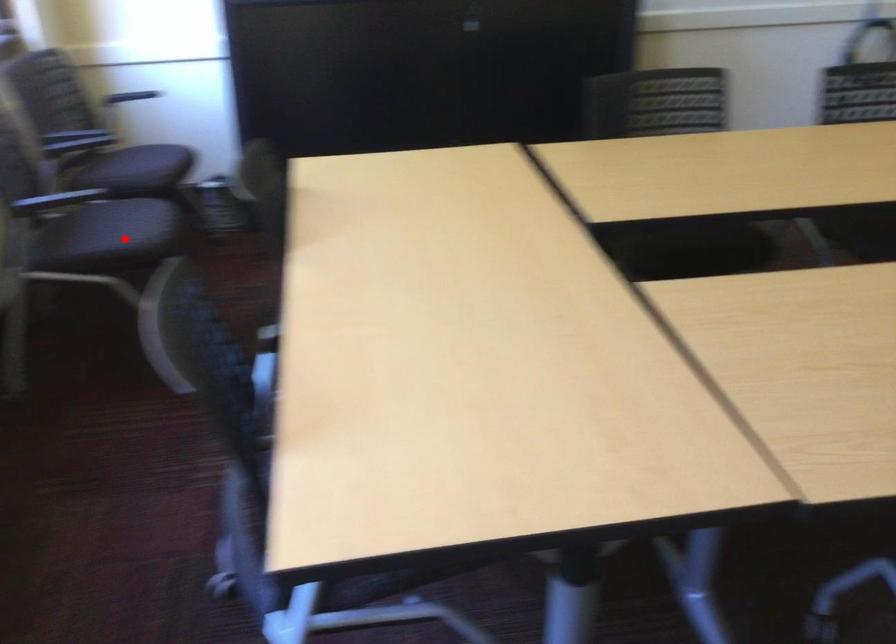
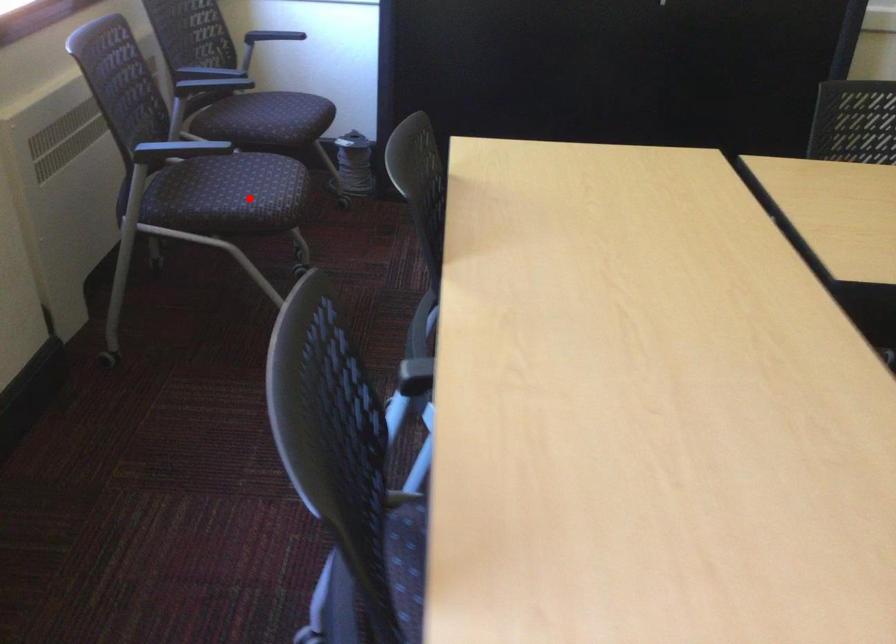
Consider the image. I am providing you with two images of the same scene from different viewpoints. A red point is marked on the first image and another point is marked on the second image. Is the marked point in image1 the same physical position as the marked point in image2?

Yes